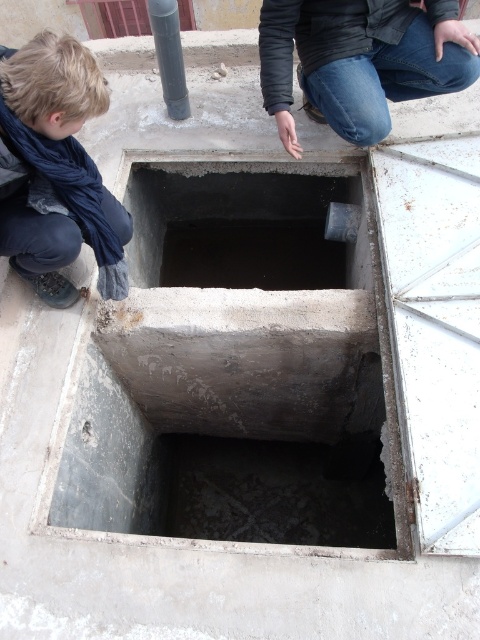
Can you confirm if blue denim jeans at upper center is positioned to the left of smooth gray pole at upper left?

In fact, blue denim jeans at upper center is to the right of smooth gray pole at upper left.

Who is more forward, (337, 92) or (147, 4)?

Positioned in front is point (337, 92).

The width and height of the screenshot is (480, 640). Identify the location of blue denim jeans at upper center. (360, 58).

From the picture: Is concrete manhole at center taller than blue denim jeans at upper center?

Yes, concrete manhole at center is taller than blue denim jeans at upper center.

Is concrete manhole at center thinner than blue denim jeans at upper center?

No, concrete manhole at center is not thinner than blue denim jeans at upper center.

This screenshot has height=640, width=480. Identify the location of concrete manhole at center. click(236, 227).

Locate an element on the screen. concrete manhole at center is located at coordinates (236, 227).

Is blue scarf at lower left wider than concrete manhole at center?

Incorrect, blue scarf at lower left's width does not surpass concrete manhole at center's.

Can you confirm if blue scarf at lower left is bigger than concrete manhole at center?

No, blue scarf at lower left is not bigger than concrete manhole at center.

Who is more distant from viewer, (13, 88) or (323, 221)?

The point (323, 221) is behind.

The height and width of the screenshot is (640, 480). What are the coordinates of `blue scarf at lower left` in the screenshot? It's located at (56, 170).